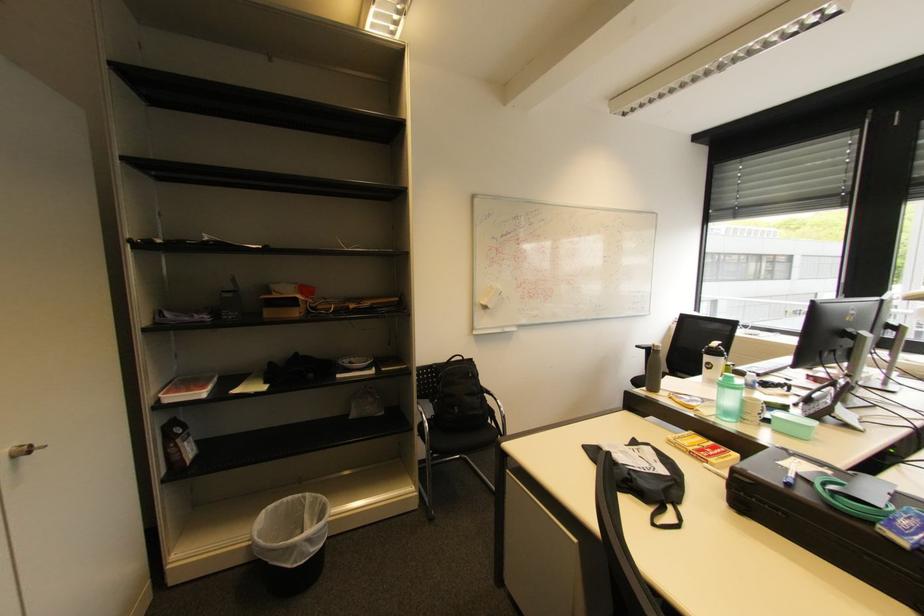
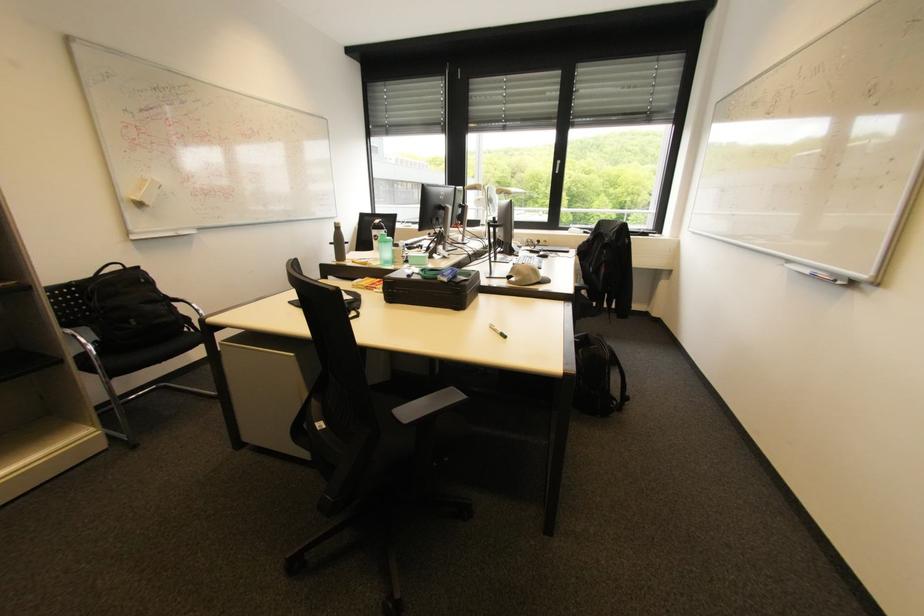
Locate, in the second image, the point that corresponds to (714,369) in the first image.

(382, 240)